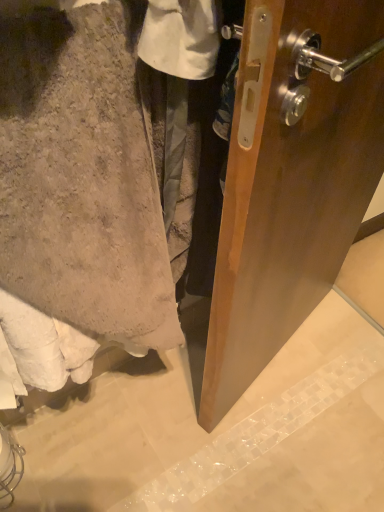
Locate an element on the screen. The image size is (384, 512). free point above smooth concrete wall at lower left (from a real-world perspective) is located at coordinates (237, 426).